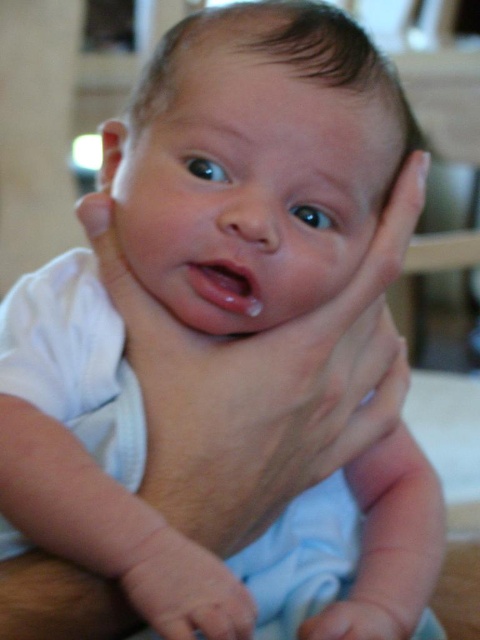
Question: Is smooth skin hand at center behind smooth skin hand at lower center?

Choices:
 (A) no
 (B) yes

Answer: (A)

Question: Is smooth skin hand at center wider than smooth skin hand at lower center?

Choices:
 (A) yes
 (B) no

Answer: (B)

Question: Is smooth skin hand at center to the right of smooth skin hand at lower center from the viewer's perspective?

Choices:
 (A) yes
 (B) no

Answer: (B)

Question: Which point is farther to the camera?

Choices:
 (A) smooth skin hand at center
 (B) smooth skin hand at lower center

Answer: (B)